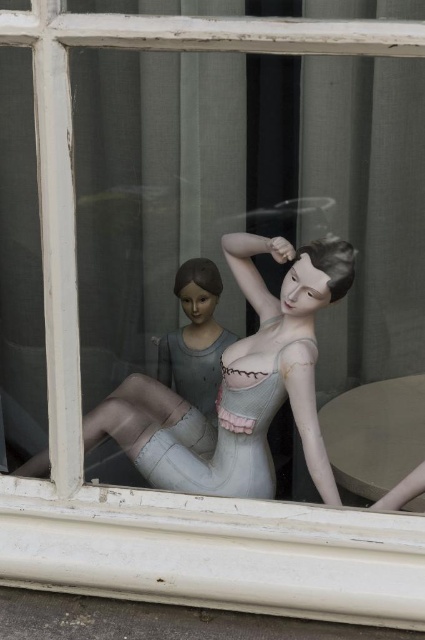
Based on the photo, you are a window cleaner who needs to clean the window between the matte white mannequin at center and the matte gray doll at center. Which object is closer to the window frame so you can start cleaning from there?

The matte white mannequin at center is positioned on the right side of the matte gray doll at center, so the matte gray doll at center is closer to the window frame. Start cleaning from the matte gray doll at center side first.

Based on the photo, you are a delivery person trying to place a small package on a surface in the scene. The package must be placed on the white painted wood at lower center without blocking the matte gray doll at center. Is this possible?

The white painted wood at lower center is below the matte gray doll at center, so placing the package on the white painted wood at lower center would not block the matte gray doll at center.